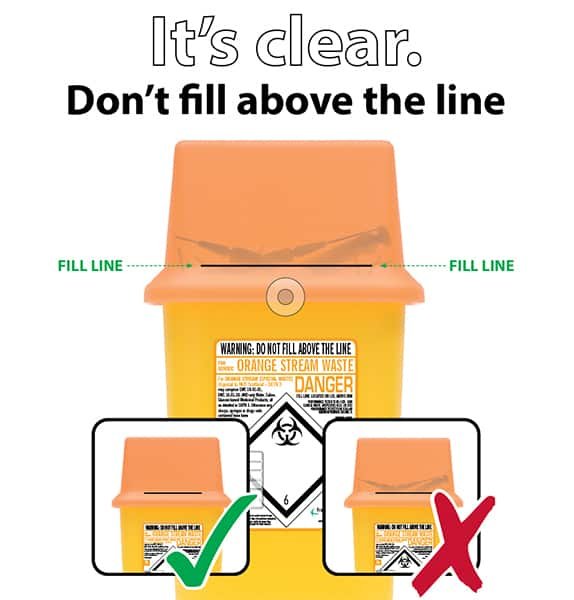
Where is `label on trash can`? This screenshot has width=574, height=600. label on trash can is located at coordinates (169, 537), (274, 374).